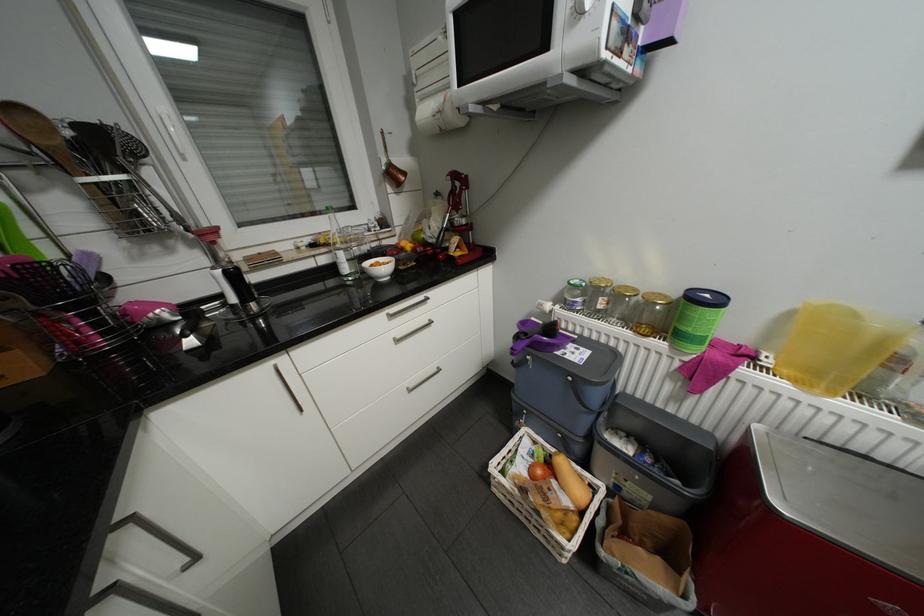
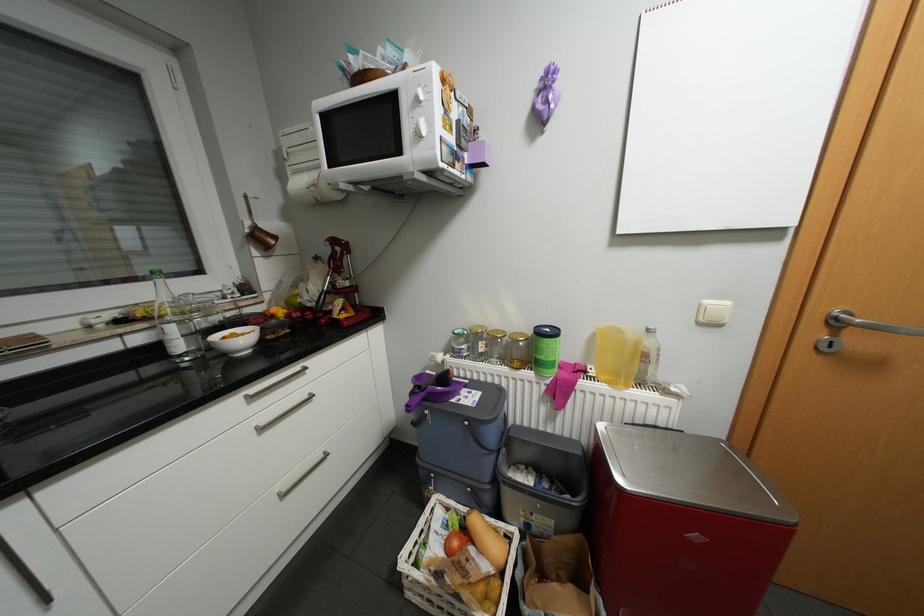
Find the pixel in the second image that matches (x=306, y=246) in the first image.

(96, 326)